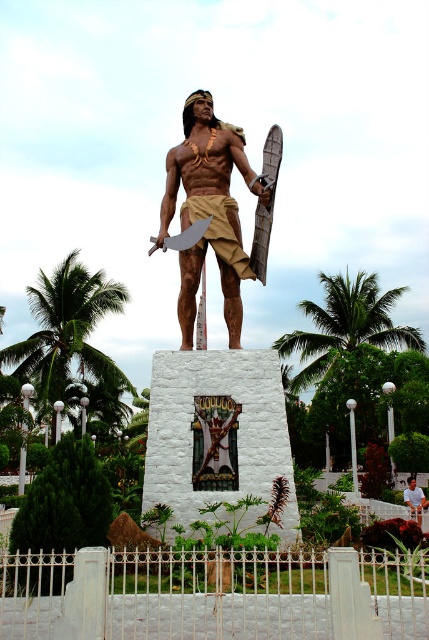
Question: Does brown polished wood statue at center appear on the left side of wooden figure at center?

Choices:
 (A) yes
 (B) no

Answer: (A)

Question: Based on their relative distances, which object is nearer to the green leafy palm tree at left?

Choices:
 (A) matte bronze statue at center
 (B) green leafy palm tree at center

Answer: (B)

Question: Can you confirm if green leafy palm tree at left is thinner than light brown wood statue at center?

Choices:
 (A) yes
 (B) no

Answer: (B)

Question: Which object is positioned farthest from the green leafy palm tree at center?

Choices:
 (A) wooden figure at center
 (B) brown polished wood statue at center
 (C) green leafy palm tree at left

Answer: (A)

Question: Observing the image, what is the correct spatial positioning of green leafy palm tree at left in reference to wooden figure at center?

Choices:
 (A) left
 (B) right

Answer: (A)

Question: Estimate the real-world distances between objects in this image. Which object is farther from the green leafy palm tree at center?

Choices:
 (A) green leafy palm tree at left
 (B) light brown wood statue at center
 (C) wooden figure at center

Answer: (C)